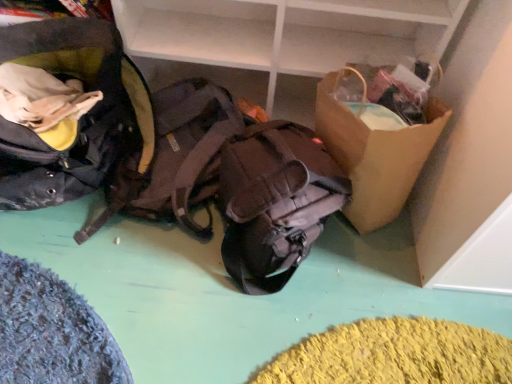
This screenshot has width=512, height=384. Identify the location of matte black backpack at left, placed as the first backpack when sorted from left to right. (66, 110).

Find the location of a particular element. brown fabric backpack at center, which is the 2th backpack in left-to-right order is located at coordinates (176, 158).

At what (x,y) coordinates should I click in order to perform the action: click on matte brown backpack at center, the third backpack in the left-to-right sequence. Please return your answer as a coordinate pair (x, y). The height and width of the screenshot is (384, 512). Looking at the image, I should click on (275, 202).

Does point (185, 18) come farther from viewer compared to point (169, 170)?

Yes, it is behind point (169, 170).

Which is more to the left, brown cardboard box at upper right or brown fabric backpack at center, positioned as the 2th backpack in right-to-left order?

brown fabric backpack at center, positioned as the 2th backpack in right-to-left order, is more to the left.

From the image's perspective, is brown cardboard box at upper right located beneath brown fabric backpack at center, which is the 2th backpack in left-to-right order?

No, from the image's perspective, brown cardboard box at upper right is not beneath brown fabric backpack at center, which is the 2th backpack in left-to-right order.

How different are the orientations of brown cardboard box at upper right and brown fabric backpack at center, positioned as the 2th backpack in right-to-left order, in degrees?

There is a 0.000333-degree angle between the facing directions of brown cardboard box at upper right and brown fabric backpack at center, positioned as the 2th backpack in right-to-left order.

How distant is brown paper bag at right from brown cardboard box at upper right?

brown paper bag at right and brown cardboard box at upper right are 8.98 inches apart.

Considering the relative sizes of brown paper bag at right and brown cardboard box at upper right in the image provided, is brown paper bag at right wider than brown cardboard box at upper right?

Correct, the width of brown paper bag at right exceeds that of brown cardboard box at upper right.

Is brown cardboard box at upper right inside brown paper bag at right?

Actually, brown cardboard box at upper right is outside brown paper bag at right.

From the image's perspective, would you say brown paper bag at right is shown under brown cardboard box at upper right?

Yes, from the image's perspective, brown paper bag at right is beneath brown cardboard box at upper right.

Between matte black backpack at left, positioned as the 3th backpack in right-to-left order, and brown fabric backpack at center, which is the 2th backpack in left-to-right order, which one has larger size?

matte black backpack at left, positioned as the 3th backpack in right-to-left order.

Is matte black backpack at left, placed as the first backpack when sorted from left to right, surrounding brown fabric backpack at center, positioned as the 2th backpack in right-to-left order?

No, matte black backpack at left, placed as the first backpack when sorted from left to right, does not contain brown fabric backpack at center, positioned as the 2th backpack in right-to-left order.

From the image's perspective, which is above, matte black backpack at left, placed as the first backpack when sorted from left to right, or brown fabric backpack at center, which is the 2th backpack in left-to-right order?

matte black backpack at left, placed as the first backpack when sorted from left to right, is shown above in the image.

Between matte black backpack at left, positioned as the 3th backpack in right-to-left order, and brown fabric backpack at center, positioned as the 2th backpack in right-to-left order, which one is positioned behind?

brown fabric backpack at center, positioned as the 2th backpack in right-to-left order, is behind.

Can you confirm if brown paper bag at right is taller than brown fabric backpack at center, positioned as the 2th backpack in right-to-left order?

Correct, brown paper bag at right is much taller as brown fabric backpack at center, positioned as the 2th backpack in right-to-left order.

Can you confirm if brown paper bag at right is bigger than brown fabric backpack at center, which is the 2th backpack in left-to-right order?

Indeed, brown paper bag at right has a larger size compared to brown fabric backpack at center, which is the 2th backpack in left-to-right order.

Are brown paper bag at right and brown fabric backpack at center, which is the 2th backpack in left-to-right order, far apart?

No, brown paper bag at right is in close proximity to brown fabric backpack at center, which is the 2th backpack in left-to-right order.

From a real-world perspective, is brown paper bag at right positioned above or below brown fabric backpack at center, positioned as the 2th backpack in right-to-left order?

In terms of real-world spatial position, brown paper bag at right is above brown fabric backpack at center, positioned as the 2th backpack in right-to-left order.

Considering the sizes of brown fabric backpack at center, positioned as the 2th backpack in right-to-left order, and brown paper bag at right in the image, is brown fabric backpack at center, positioned as the 2th backpack in right-to-left order, bigger or smaller than brown paper bag at right?

Considering their sizes, brown fabric backpack at center, positioned as the 2th backpack in right-to-left order, takes up less space than brown paper bag at right.

How different are the orientations of brown fabric backpack at center, positioned as the 2th backpack in right-to-left order, and brown paper bag at right in degrees?

They differ by 0.000352 degrees in their facing directions.

Considering the sizes of objects brown fabric backpack at center, positioned as the 2th backpack in right-to-left order, and brown paper bag at right in the image provided, who is shorter, brown fabric backpack at center, positioned as the 2th backpack in right-to-left order, or brown paper bag at right?

Standing shorter between the two is brown fabric backpack at center, positioned as the 2th backpack in right-to-left order.

Which is more to the right, brown fabric backpack at center, positioned as the 2th backpack in right-to-left order, or brown paper bag at right?

brown paper bag at right.

Does matte black backpack at left, positioned as the 3th backpack in right-to-left order, have a lesser height compared to brown cardboard box at upper right?

Indeed, matte black backpack at left, positioned as the 3th backpack in right-to-left order, has a lesser height compared to brown cardboard box at upper right.

Is matte black backpack at left, positioned as the 3th backpack in right-to-left order, further to the viewer compared to brown cardboard box at upper right?

No, it is not.

Which is closer to the camera, (126, 57) or (330, 41)?

Clearly, point (126, 57) is closer to the camera than point (330, 41).

Is matte black backpack at left, positioned as the 3th backpack in right-to-left order, at the right side of brown cardboard box at upper right?

Incorrect, matte black backpack at left, positioned as the 3th backpack in right-to-left order, is not on the right side of brown cardboard box at upper right.

From the image's perspective, would you say matte black backpack at left, positioned as the 3th backpack in right-to-left order, is shown under matte brown backpack at center, the 1th backpack viewed from the right?

No.

What's the angular difference between matte black backpack at left, positioned as the 3th backpack in right-to-left order, and matte brown backpack at center, the third backpack in the left-to-right sequence,'s facing directions?

9e-05 degrees.

Considering the sizes of matte black backpack at left, positioned as the 3th backpack in right-to-left order, and matte brown backpack at center, the third backpack in the left-to-right sequence, in the image, is matte black backpack at left, positioned as the 3th backpack in right-to-left order, taller or shorter than matte brown backpack at center, the third backpack in the left-to-right sequence,?

matte black backpack at left, positioned as the 3th backpack in right-to-left order, is taller than matte brown backpack at center, the third backpack in the left-to-right sequence.

Is matte black backpack at left, positioned as the 3th backpack in right-to-left order, next to matte brown backpack at center, the 1th backpack viewed from the right?

No, matte black backpack at left, positioned as the 3th backpack in right-to-left order, is not with matte brown backpack at center, the 1th backpack viewed from the right.

You are a GUI agent. You are given a task and a screenshot of the screen. Output one action in this format:
    pyautogui.click(x=<x>, y=<y>)
    Task: Click on the shelf on the right of the brown fabric backpack at center, positioned as the 2th backpack in right-to-left order
    Image resolution: width=512 pixels, height=384 pixels.
    Given the screenshot: What is the action you would take?
    pyautogui.click(x=287, y=34)

At what (x,y) coordinates should I click in order to perform the action: click on cardboard box that is in front of the brown cardboard box at upper right. Please return your answer as a coordinate pair (x, y). This screenshot has width=512, height=384. Looking at the image, I should click on (375, 155).

Looking at the image, which one is located further to brown cardboard box at upper right, matte brown backpack at center, the 1th backpack viewed from the right, or brown fabric backpack at center, which is the 2th backpack in left-to-right order?

matte brown backpack at center, the 1th backpack viewed from the right, lies further to brown cardboard box at upper right than the other object.

Based on their spatial positions, is matte black backpack at left, placed as the first backpack when sorted from left to right, or brown fabric backpack at center, positioned as the 2th backpack in right-to-left order, closer to brown paper bag at right?

Among the two, brown fabric backpack at center, positioned as the 2th backpack in right-to-left order, is located nearer to brown paper bag at right.

Based on the photo, when comparing their distances from matte brown backpack at center, the 1th backpack viewed from the right, does brown cardboard box at upper right or brown paper bag at right seem further?

Based on the image, brown cardboard box at upper right appears to be further to matte brown backpack at center, the 1th backpack viewed from the right.

When comparing their distances from matte brown backpack at center, the 1th backpack viewed from the right, does brown paper bag at right or brown cardboard box at upper right seem further?

The object further to matte brown backpack at center, the 1th backpack viewed from the right, is brown cardboard box at upper right.

Looking at the image, which one is located closer to brown fabric backpack at center, positioned as the 2th backpack in right-to-left order, brown cardboard box at upper right or brown paper bag at right?

Among the two, brown cardboard box at upper right is located nearer to brown fabric backpack at center, positioned as the 2th backpack in right-to-left order.

From the image, which object appears to be farther from brown cardboard box at upper right, brown paper bag at right or matte black backpack at left, positioned as the 3th backpack in right-to-left order?

matte black backpack at left, positioned as the 3th backpack in right-to-left order, lies further to brown cardboard box at upper right than the other object.

Looking at the image, which one is located closer to brown cardboard box at upper right, matte black backpack at left, placed as the first backpack when sorted from left to right, or brown paper bag at right?

brown paper bag at right is positioned closer to the anchor brown cardboard box at upper right.

Considering their positions, is brown cardboard box at upper right positioned closer to matte black backpack at left, placed as the first backpack when sorted from left to right, than brown fabric backpack at center, positioned as the 2th backpack in right-to-left order?

brown fabric backpack at center, positioned as the 2th backpack in right-to-left order, is closer to matte black backpack at left, placed as the first backpack when sorted from left to right.

The width and height of the screenshot is (512, 384). I want to click on shelf between matte black backpack at left, positioned as the 3th backpack in right-to-left order, and brown paper bag at right, in the horizontal direction, so click(x=287, y=34).

The height and width of the screenshot is (384, 512). I want to click on shelf situated between brown fabric backpack at center, which is the 2th backpack in left-to-right order, and brown paper bag at right from left to right, so click(287, 34).

Where is `shelf between matte black backpack at left, placed as the first backpack when sorted from left to right, and matte brown backpack at center, the 1th backpack viewed from the right`? shelf between matte black backpack at left, placed as the first backpack when sorted from left to right, and matte brown backpack at center, the 1th backpack viewed from the right is located at coordinates (287, 34).

Identify the location of backpack between matte black backpack at left, placed as the first backpack when sorted from left to right, and brown cardboard box at upper right, in the horizontal direction. This screenshot has width=512, height=384. (176, 158).